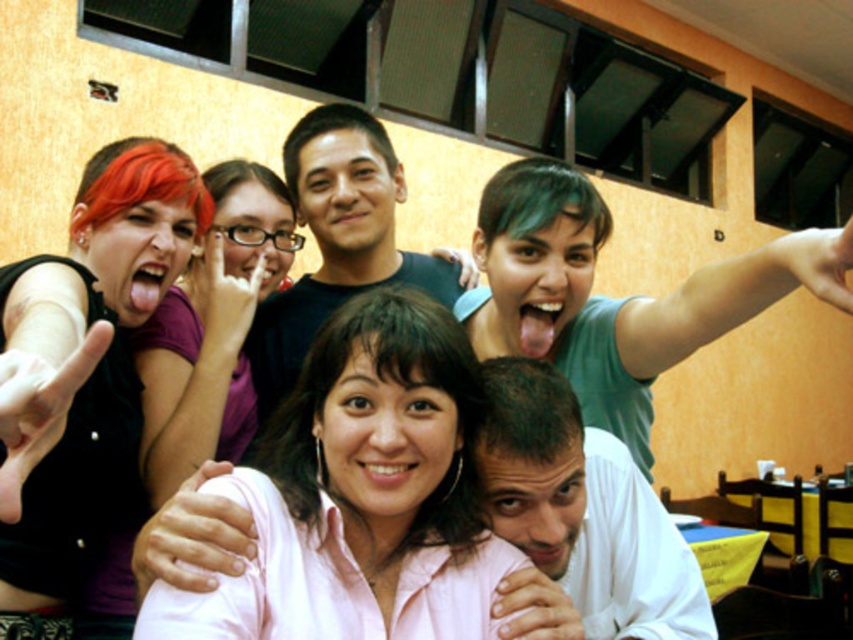
Looking at this image, you are standing in the group photo and want to move from your current position at point (236, 340) to the exit located at point (294, 148). Is the exit directly in front of you or behind you?

The exit at point (294, 148) is behind point (236, 340), so the exit is behind you.

You are a photographer trying to capture the clear plastic glasses at center in the image. However, the black matte shirt at center is blocking your view. Can you determine if the glasses are still visible?

The black matte shirt at center is positioned over clear plastic glasses at center, so the glasses are completely blocked and not visible.